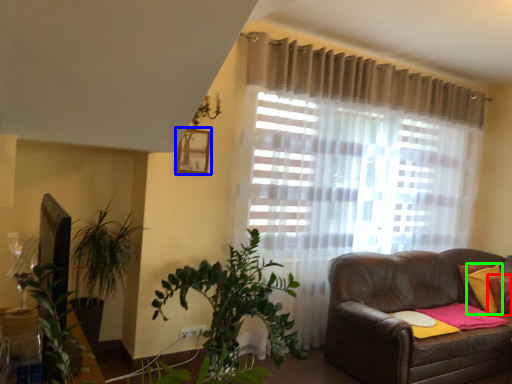
Question: Estimate the real-world distances between objects in this image. Which object is farther from pillow (highlighted by a red box), picture frame (highlighted by a blue box) or pillow (highlighted by a green box)?

Choices:
 (A) picture frame
 (B) pillow

Answer: (A)